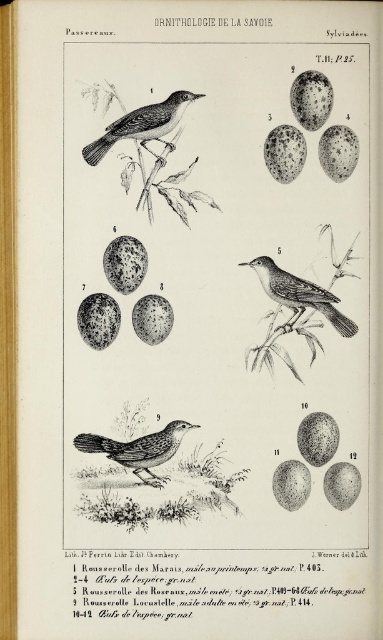
Is point (119, 452) behind point (302, 289)?

No, it is not.

Is brown textured bird at center above smooth brown bird at center?

No.

This screenshot has height=640, width=383. I want to click on brown textured bird at center, so click(x=139, y=449).

The width and height of the screenshot is (383, 640). I want to click on brown textured bird at center, so click(139, 449).

Does brown textured bird at center have a larger size compared to smooth brown bird at upper center?

Actually, brown textured bird at center might be smaller than smooth brown bird at upper center.

Looking at this image, does brown textured bird at center appear over smooth brown bird at upper center?

No, brown textured bird at center is not above smooth brown bird at upper center.

Who is more distant from viewer, [86,442] or [173,109]?

The point [86,442] is behind.

In order to click on brown textured bird at center in this screenshot , I will do `click(139, 449)`.

Is point (129, 131) farther from camera compared to point (261, 284)?

No, (129, 131) is in front of (261, 284).

Between point (132, 132) and point (297, 301), which one is positioned in front?

Point (132, 132)

Between point (155, 116) and point (292, 275), which one is positioned behind?

Positioned behind is point (292, 275).

The image size is (383, 640). Identify the location of smooth brown bird at upper center. (142, 125).